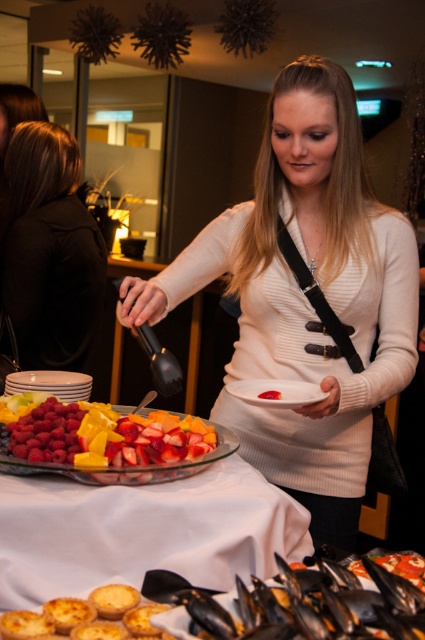
You are a guest at the event and want to grab a fruit from the bowl. Since the translucent glass bowl of fruit at center and the white matte plate at center are both in your way, which one do you need to move first?

The translucent glass bowl of fruit at center is located below the white matte plate at center, so you need to move the white matte plate at center first to access the bowl.